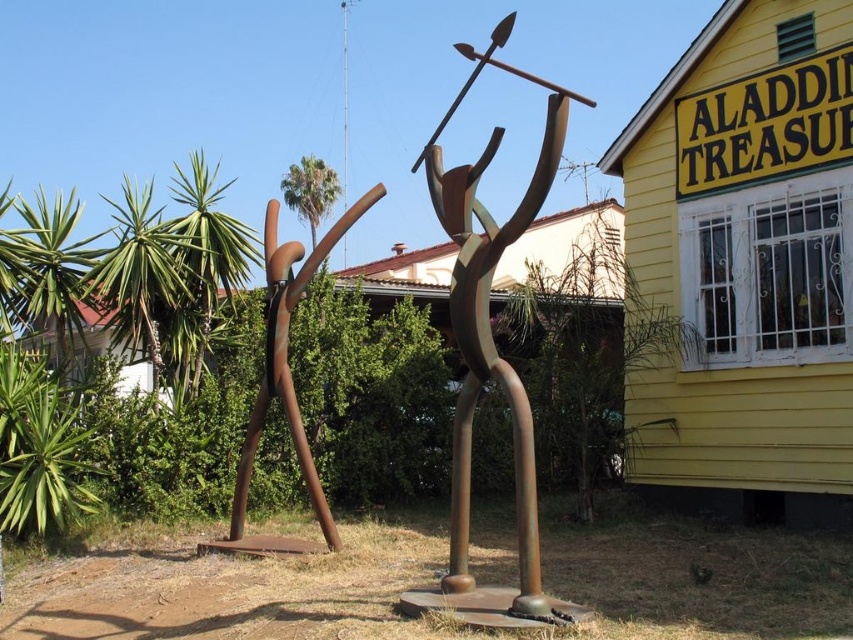
You are standing in front of the two rusty metal sculptures in the outdoor scene. Which one, the rusty metal figure at center or the rusty metal sculpture at center, is positioned to the right?

The rusty metal figure at center is positioned to the right of the rusty metal sculpture at center.

You are standing in front of the two metal sculptures in the outdoor scene. You notice two points marked on the sculptures. The first point is at coordinate (509, 600) and the second is at (238, 468). Which point is nearer to you?

Point (509, 600) is closer to the viewer than point (238, 468).

You are an artist planning to photograph both the rusty metal figure at center and the rusty metal sculpture at center. Since you want to capture their full height in the frame, which one requires you to stand further back?

The rusty metal sculpture at center is taller than the rusty metal figure at center. To capture its full height, you need to stand further back compared to photographing the rusty metal figure at center.